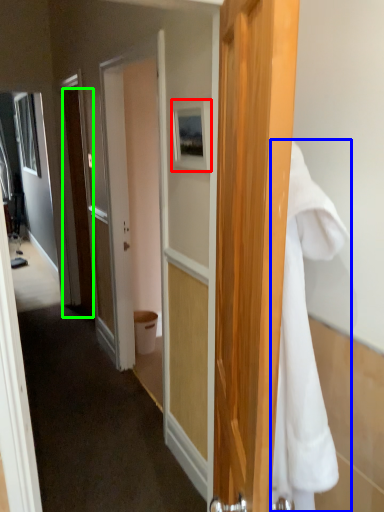
Question: Considering the real-world distances, which object is farthest from picture frame (highlighted by a red box)? towel/napkin (highlighted by a blue box) or door (highlighted by a green box)?

Choices:
 (A) towel/napkin
 (B) door

Answer: (B)